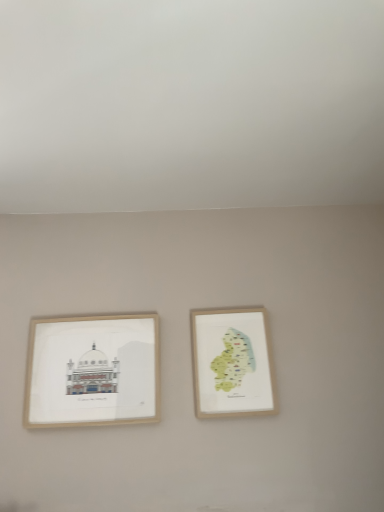
Question: Is point [x=84, y=394] positioned closer to the camera than point [x=221, y=410]?

Choices:
 (A) farther
 (B) closer

Answer: (A)

Question: Is wooden picture frame at left, marked as the first picture frame in a left-to-right arrangement, wider or thinner than wooden map at center right, the second picture frame positioned from the left?

Choices:
 (A) thin
 (B) wide

Answer: (B)

Question: In terms of height, does wooden picture frame at left, arranged as the 2th picture frame when viewed from the right, look taller or shorter compared to wooden map at center right, the 1th picture frame from the right?

Choices:
 (A) short
 (B) tall

Answer: (B)

Question: From the image's perspective, relative to wooden picture frame at left, arranged as the 2th picture frame when viewed from the right, is wooden map at center right, the 1th picture frame from the right, above or below?

Choices:
 (A) below
 (B) above

Answer: (B)

Question: In terms of height, does wooden map at center right, the second picture frame positioned from the left, look taller or shorter compared to wooden picture frame at left, marked as the first picture frame in a left-to-right arrangement?

Choices:
 (A) short
 (B) tall

Answer: (A)

Question: Considering the positions of point (203, 330) and point (119, 386), is point (203, 330) closer or farther from the camera than point (119, 386)?

Choices:
 (A) closer
 (B) farther

Answer: (B)

Question: Considering the positions of wooden map at center right, the second picture frame positioned from the left, and wooden picture frame at left, marked as the first picture frame in a left-to-right arrangement, in the image, is wooden map at center right, the second picture frame positioned from the left, wider or thinner than wooden picture frame at left, marked as the first picture frame in a left-to-right arrangement,?

Choices:
 (A) thin
 (B) wide

Answer: (A)